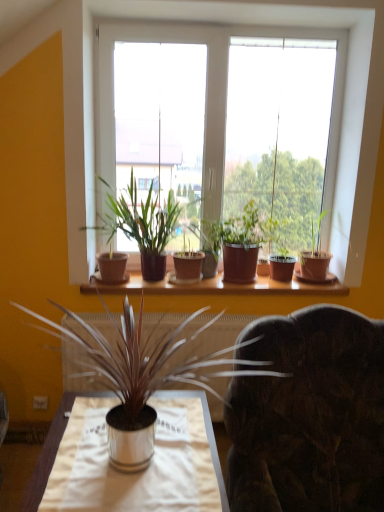
This screenshot has height=512, width=384. Identify the location of white plastic window at center. (113, 102).

In order to click on brown clay pot at center, the fourth houseplant viewed from the back in this screenshot , I will do `click(140, 223)`.

Locate an element on the screen. This screenshot has height=512, width=384. metallic silver table at lower center is located at coordinates (51, 450).

Measure the distance between metallic silver table at lower center and camera.

1.14 meters.

The width and height of the screenshot is (384, 512). I want to click on dark brown leather swivel chair at center, so click(309, 415).

I want to click on terracotta pot at center, marked as the fifth houseplant in a front-to-back arrangement, so click(209, 245).

At what (x,y) coordinates should I click in order to perform the action: click on white plastic window at center. Please return your answer as a coordinate pair (x, y). Looking at the image, I should click on (113, 102).

Which object is thinner, silver metallic vase at center, the 1th houseplant when ordered from front to back, or matte brown pot at center, the 3th houseplant in the front-to-back sequence?

matte brown pot at center, the 3th houseplant in the front-to-back sequence.

Is silver metallic vase at center, the fifth houseplant in the back-to-front sequence, smaller than matte brown pot at center, the third houseplant viewed from the back?

Actually, silver metallic vase at center, the fifth houseplant in the back-to-front sequence, might be larger than matte brown pot at center, the third houseplant viewed from the back.

Between silver metallic vase at center, the 1th houseplant when ordered from front to back, and matte brown pot at center, the 3th houseplant in the front-to-back sequence, which one has more height?

Standing taller between the two is silver metallic vase at center, the 1th houseplant when ordered from front to back.

Could you tell me if silver metallic vase at center, the fifth houseplant in the back-to-front sequence, is turned towards matte brown pot at center, the 3th houseplant in the front-to-back sequence?

No.

From the image's perspective, relative to wooden shelf at center, is metallic silver table at lower center above or below?

Based on their image positions, metallic silver table at lower center is located beneath wooden shelf at center.

Is metallic silver table at lower center taller than wooden shelf at center?

Yes.

Is metallic silver table at lower center wider or thinner than wooden shelf at center?

In the image, metallic silver table at lower center appears to be wider than wooden shelf at center.

Would you say metallic silver table at lower center is to the left or to the right of wooden shelf at center in the picture?

metallic silver table at lower center is positioned on wooden shelf at center's left side.

Which is behind, point (313, 277) or point (104, 141)?

The point (313, 277) is farther.

There is a white plastic window at center. Find the location of `the 4th houseplant below it (from the image's perspective)`. the 4th houseplant below it (from the image's perspective) is located at coordinates (315, 257).

Who is taller, green matte plant at upper right, the fourth houseplant viewed from the front, or white plastic window at center?

white plastic window at center.

From the image's perspective, is green matte plant at upper right, which appears as the second houseplant when viewed from the back, below white plastic window at center?

Yes, from the image's perspective, green matte plant at upper right, which appears as the second houseplant when viewed from the back, is beneath white plastic window at center.

From the image's perspective, is silver metallic vase at center, the 1th houseplant when ordered from front to back, located above or below green matte plant at upper right, the fourth houseplant viewed from the front?

From the image's perspective, silver metallic vase at center, the 1th houseplant when ordered from front to back, appears below green matte plant at upper right, the fourth houseplant viewed from the front.

Who is bigger, silver metallic vase at center, the 1th houseplant when ordered from front to back, or green matte plant at upper right, the fourth houseplant viewed from the front?

With larger size is silver metallic vase at center, the 1th houseplant when ordered from front to back.

Is the depth of silver metallic vase at center, the fifth houseplant in the back-to-front sequence, less than that of green matte plant at upper right, which appears as the second houseplant when viewed from the back?

Yes, silver metallic vase at center, the fifth houseplant in the back-to-front sequence, is closer to the viewer.

Considering the positions of objects dark brown leather swivel chair at center and silver metallic vase at center, the 1th houseplant when ordered from front to back, in the image provided, who is more to the right, dark brown leather swivel chair at center or silver metallic vase at center, the 1th houseplant when ordered from front to back,?

Positioned to the right is dark brown leather swivel chair at center.

Is dark brown leather swivel chair at center placed right next to silver metallic vase at center, the fifth houseplant in the back-to-front sequence?

No, dark brown leather swivel chair at center is not with silver metallic vase at center, the fifth houseplant in the back-to-front sequence.

From a real-world perspective, does dark brown leather swivel chair at center stand above silver metallic vase at center, the fifth houseplant in the back-to-front sequence?

No, from a real-world perspective, dark brown leather swivel chair at center is not above silver metallic vase at center, the fifth houseplant in the back-to-front sequence.

How distant is dark brown leather swivel chair at center from silver metallic vase at center, the fifth houseplant in the back-to-front sequence?

13.09 inches.

Is wooden shelf at center smaller than green matte plant at upper right, the fourth houseplant viewed from the front?

Correct, wooden shelf at center occupies less space than green matte plant at upper right, the fourth houseplant viewed from the front.

Looking at their sizes, would you say wooden shelf at center is wider or thinner than green matte plant at upper right, which appears as the second houseplant when viewed from the back?

In the image, wooden shelf at center appears to be wider than green matte plant at upper right, which appears as the second houseplant when viewed from the back.

From the image's perspective, which object appears higher, wooden shelf at center or green matte plant at upper right, which appears as the second houseplant when viewed from the back?

From the image's view, green matte plant at upper right, which appears as the second houseplant when viewed from the back, is above.

Can you confirm if wooden shelf at center is positioned to the right of green matte plant at upper right, which appears as the second houseplant when viewed from the back?

In fact, wooden shelf at center is to the left of green matte plant at upper right, which appears as the second houseplant when viewed from the back.

Considering the relative sizes of green matte plant at upper right, which appears as the second houseplant when viewed from the back, and wooden shelf at center in the image provided, is green matte plant at upper right, which appears as the second houseplant when viewed from the back, smaller than wooden shelf at center?

Actually, green matte plant at upper right, which appears as the second houseplant when viewed from the back, might be larger than wooden shelf at center.

Are green matte plant at upper right, the fourth houseplant viewed from the front, and wooden shelf at center far apart?

No, there isn't a large distance between green matte plant at upper right, the fourth houseplant viewed from the front, and wooden shelf at center.

From the image's perspective, between green matte plant at upper right, the fourth houseplant viewed from the front, and wooden shelf at center, who is located below?

wooden shelf at center appears lower in the image.

Between green matte plant at upper right, the fourth houseplant viewed from the front, and wooden shelf at center, which one appears on the left side from the viewer's perspective?

wooden shelf at center.

From the image's perspective, count 2nd houseplants downward from the matte brown pot at center, the 3th houseplant in the front-to-back sequence, and point to it. Please provide its 2D coordinates.

[(150, 359)]

This screenshot has height=512, width=384. What are the coordinates of `window sill behind the metallic silver table at lower center` in the screenshot? It's located at (217, 286).

Consider the image. Estimate the real-world distances between objects in this image. Which object is further from green matte plant at upper right, the fourth houseplant viewed from the front, white plastic window at center or silver metallic vase at center, the 1th houseplant when ordered from front to back?

silver metallic vase at center, the 1th houseplant when ordered from front to back, is positioned further to the anchor green matte plant at upper right, the fourth houseplant viewed from the front.

Based on their spatial positions, is green matte plant at upper right, which appears as the second houseplant when viewed from the back, or terracotta pot at center, which is the first houseplant in back-to-front order, closer to wooden shelf at center?

terracotta pot at center, which is the first houseplant in back-to-front order.

Looking at the image, which one is located closer to green matte plant at upper right, which appears as the second houseplant when viewed from the back, terracotta pot at center, marked as the fifth houseplant in a front-to-back arrangement, or white plastic window at center?

terracotta pot at center, marked as the fifth houseplant in a front-to-back arrangement, is positioned closer to the anchor green matte plant at upper right, which appears as the second houseplant when viewed from the back.

Looking at the image, which one is located further to white plastic window at center, metallic silver table at lower center or terracotta pot at center, marked as the fifth houseplant in a front-to-back arrangement?

metallic silver table at lower center is positioned further to the anchor white plastic window at center.

When comparing their distances from wooden shelf at center, does metallic silver table at lower center or green matte plant at upper right, which appears as the second houseplant when viewed from the back, seem closer?

Based on the image, green matte plant at upper right, which appears as the second houseplant when viewed from the back, appears to be nearer to wooden shelf at center.

Estimate the real-world distances between objects in this image. Which object is further from matte brown pot at center, the 3th houseplant in the front-to-back sequence, metallic silver table at lower center or brown clay pot at center, which is the 2th houseplant from front to back?

Among the two, metallic silver table at lower center is located further to matte brown pot at center, the 3th houseplant in the front-to-back sequence.

Which object lies nearer to the anchor point brown clay pot at center, the fourth houseplant viewed from the back, terracotta pot at center, which is the first houseplant in back-to-front order, or white plastic window at center?

white plastic window at center is closer to brown clay pot at center, the fourth houseplant viewed from the back.

When comparing their distances from white plastic window at center, does green matte plant at upper right, the fourth houseplant viewed from the front, or metallic silver table at lower center seem closer?

green matte plant at upper right, the fourth houseplant viewed from the front, is closer to white plastic window at center.

Locate an element on the screen. window sill between brown clay pot at center, the fourth houseplant viewed from the back, and matte brown pot at center, the 3th houseplant in the front-to-back sequence, in the horizontal direction is located at coordinates (217, 286).

Image resolution: width=384 pixels, height=512 pixels. What are the coordinates of `window between silver metallic vase at center, the fifth houseplant in the back-to-front sequence, and green matte plant at upper right, which appears as the second houseplant when viewed from the back, along the z-axis` in the screenshot? It's located at (113, 102).

Find the location of a particular element. This screenshot has width=384, height=512. houseplant positioned between dark brown leather swivel chair at center and brown clay pot at center, which is the 2th houseplant from front to back, from near to far is located at coordinates (150, 359).

The image size is (384, 512). What are the coordinates of `window sill between metallic silver table at lower center and terracotta pot at center, marked as the fifth houseplant in a front-to-back arrangement, along the z-axis` in the screenshot? It's located at (217, 286).